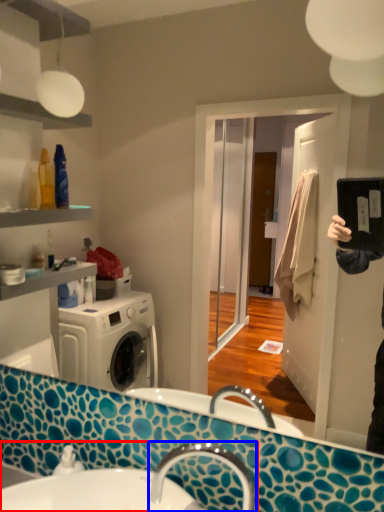
Question: Among these objects, which one is farthest to the camera, sink (highlighted by a red box) or tap (highlighted by a blue box)?

Choices:
 (A) sink
 (B) tap

Answer: (B)